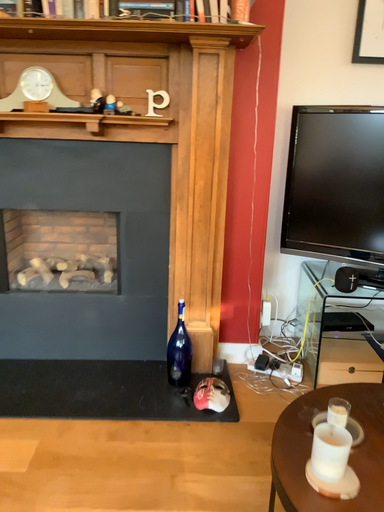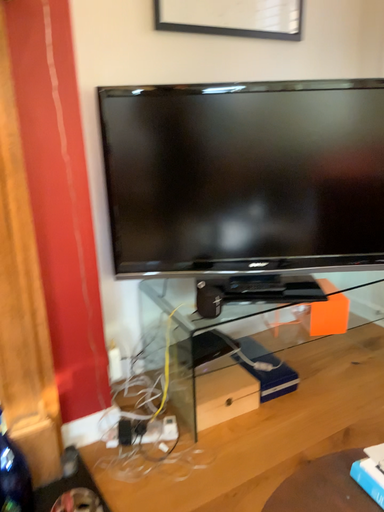
Question: Which way did the camera rotate in the video?

Choices:
 (A) rotated right
 (B) rotated left

Answer: (A)